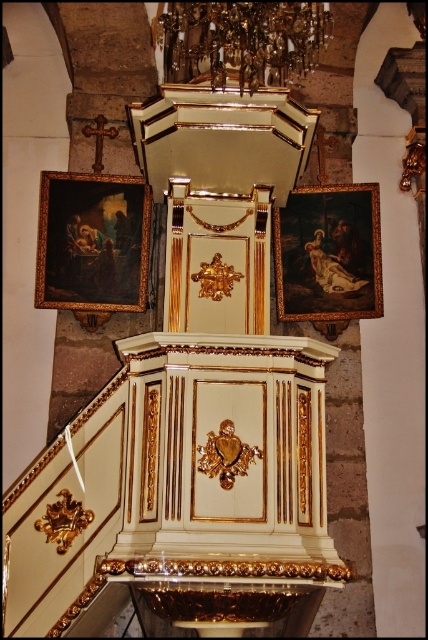
You are an art conservator assessing the space between two paintings in the cathedral. The oil painting at left and wooden dark painting at right are positioned side by side. Which painting has a greater height?

The oil painting at left is taller than the wooden dark painting at right, so it has a greater height.

You are an interior designer assessing the symmetry of the wall where the oil painting at left and wooden dark painting at right are placed. Which painting takes up more horizontal space on the wall?

The oil painting at left takes up more horizontal space on the wall because its width surpasses that of the wooden dark painting at right.

Where is the oil painting at left located?

The oil painting at left is located at point [92,243].